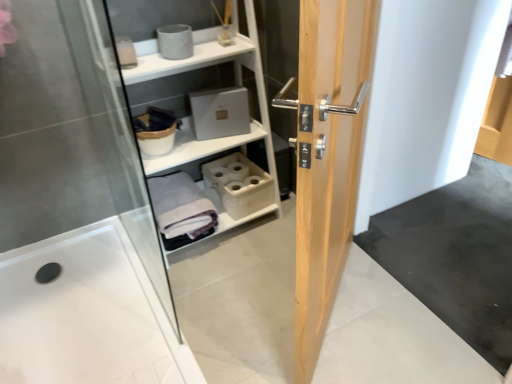
Question: From the image's perspective, is gray cotton bath towel at center above or below transparent glass shower door at left?

Choices:
 (A) below
 (B) above

Answer: (A)

Question: Visually, is gray cotton bath towel at center positioned to the left or to the right of transparent glass shower door at left?

Choices:
 (A) right
 (B) left

Answer: (A)

Question: Estimate the real-world distances between objects in this image. Which object is farther from the gray cotton bath towel at center?

Choices:
 (A) white glossy bath at lower left
 (B) light wood door at center
 (C) white matte shelf at upper center
 (D) transparent glass shower door at left

Answer: (B)

Question: Estimate the real-world distances between objects in this image. Which object is farther from the gray cotton bath towel at center?

Choices:
 (A) light wood door at center
 (B) transparent glass shower door at left
 (C) white glossy bath at lower left
 (D) white matte shelf at upper center

Answer: (A)